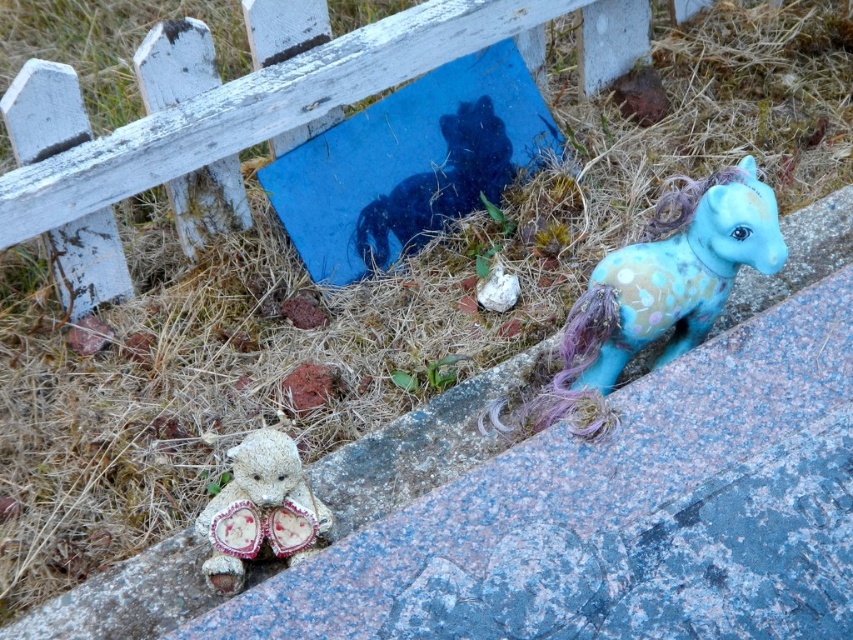
You are a child who wants to place a new toy between the white wooden fence at upper left and the blue felt pony at right. The new toy is 30 inches long. Will there be enough space between them to fit the toy?

The distance between the white wooden fence at upper left and the blue felt pony at right is 33.19 inches. Since the new toy is 30 inches long, there is enough space to place it between them.

You are standing at the center of the image and want to place a new flower pot between the toy pony and the white wooden fence at upper left. Based on their positions, can you determine if there is enough space to fit the flower pot between them?

The white wooden fence at upper left is located at point (245,113), so yes, there is enough space to fit the flower pot between the toy pony and the white wooden fence at upper left as their positions are separated by a distance that can accommodate the flower pot.